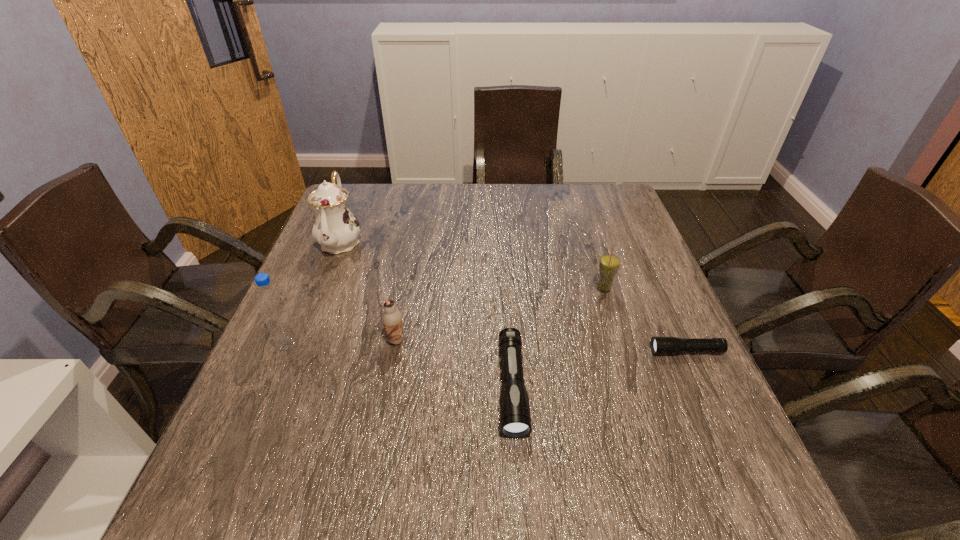
Image resolution: width=960 pixels, height=540 pixels. Identify the location of vacant space situated 0.360m at the lens end of the shorter flashlight. (485, 351).

The image size is (960, 540). Find the location of `free location located at the lens end of the shorter flashlight`. free location located at the lens end of the shorter flashlight is located at coordinates (517, 351).

Find the location of a particular element. This screenshot has width=960, height=540. free region located 0.120m at the lens end of the shorter flashlight is located at coordinates (596, 351).

Where is `vacant region located on the back of the third tallest object`? This screenshot has height=540, width=960. vacant region located on the back of the third tallest object is located at coordinates coord(586,232).

Where is `free space located 0.230m on the front of the chocolate milk`? This screenshot has width=960, height=540. free space located 0.230m on the front of the chocolate milk is located at coordinates (375, 447).

Locate an element on the screen. This screenshot has height=540, width=960. vacant area situated 0.210m on the front of the water bottle is located at coordinates (246, 445).

Locate an element on the screen. free spot located on the right of the farthest object is located at coordinates (490, 241).

Locate an element on the screen. The height and width of the screenshot is (540, 960). object present at the far edge is located at coordinates (335, 228).

The image size is (960, 540). In order to click on object that is at the near edge in this screenshot , I will do `click(515, 419)`.

Identify the location of water bottle situated at the left edge. The width and height of the screenshot is (960, 540). (270, 299).